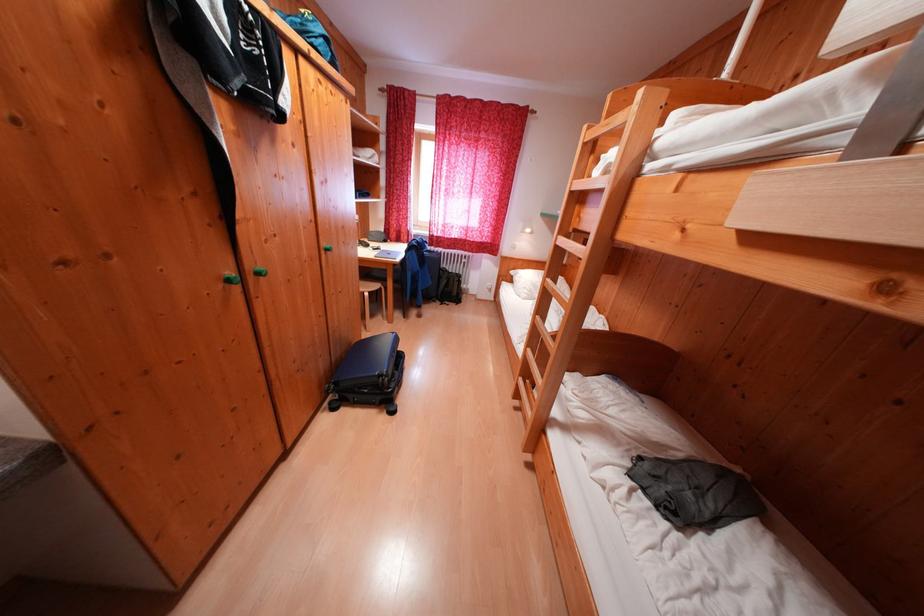
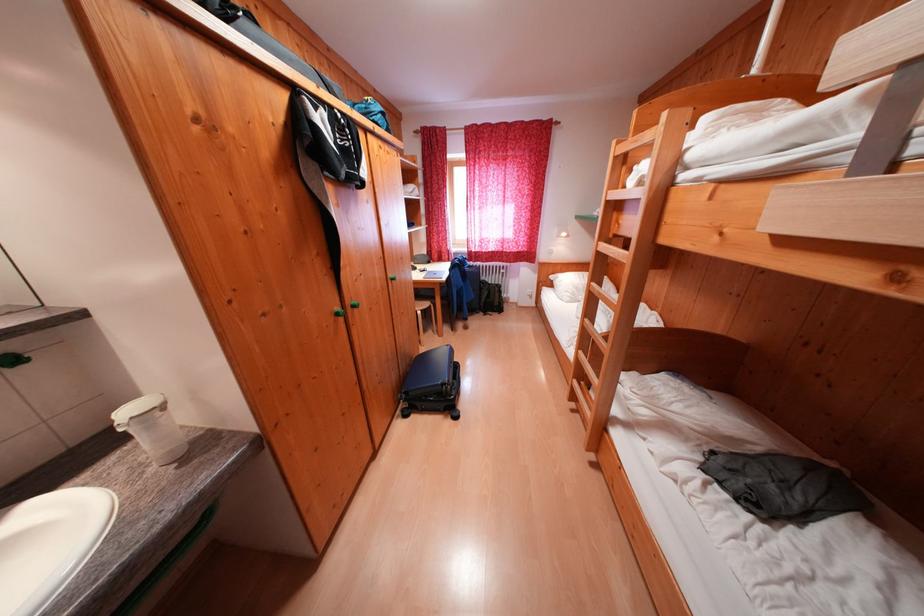
In the second image, find the point that corresponds to the point at 395,376 in the first image.

(456, 384)